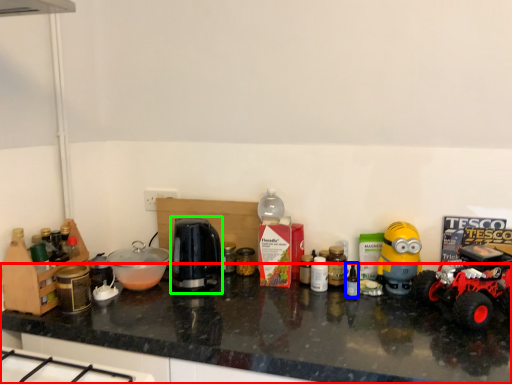
Question: Based on their relative distances, which object is nearer to countertop (highlighted by a red box)? Choose from bottle (highlighted by a blue box) and coffee machine (highlighted by a green box).

Choices:
 (A) bottle
 (B) coffee machine

Answer: (B)